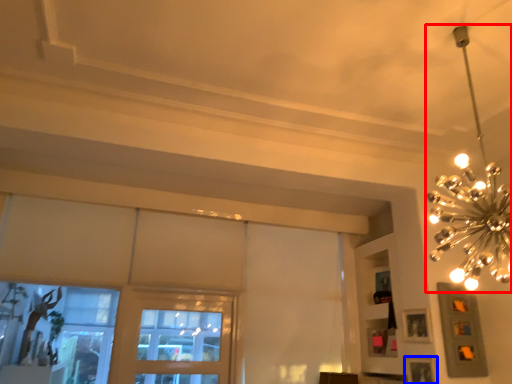
Question: Which of the following is the closest to the observer, lamp (highlighted by a red box) or picture frame (highlighted by a blue box)?

Choices:
 (A) lamp
 (B) picture frame

Answer: (A)